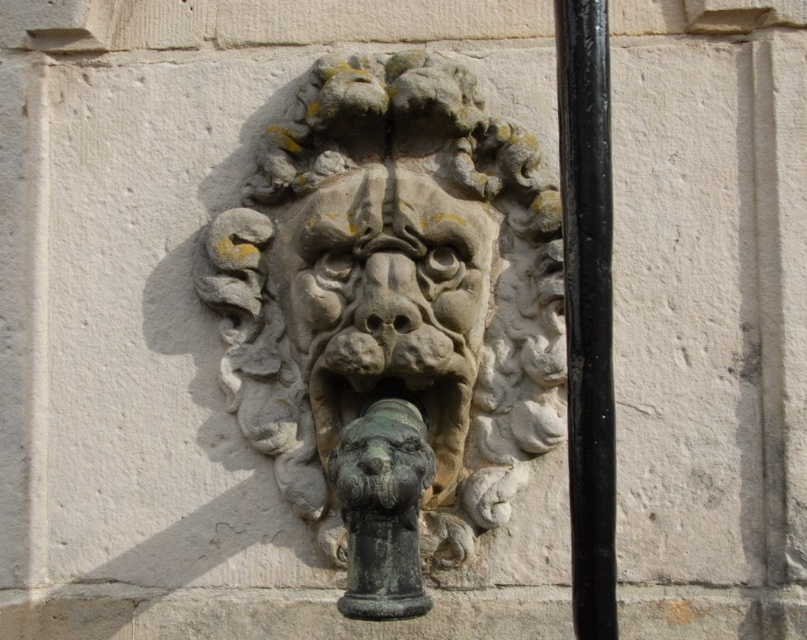
Question: Is stone textured face at center below black metal pole at right?

Choices:
 (A) no
 (B) yes

Answer: (A)

Question: Which point appears closest to the camera in this image?

Choices:
 (A) (554, 256)
 (B) (583, 33)

Answer: (B)

Question: Which of the following is the closest to the observer?

Choices:
 (A) (557, 380)
 (B) (339, 248)
 (C) (358, 460)
 (D) (567, 324)

Answer: (C)

Question: Is black metal pole at right to the right of bronze statue at center from the viewer's perspective?

Choices:
 (A) yes
 (B) no

Answer: (A)

Question: Which point is closer to the camera taking this photo?

Choices:
 (A) (394, 454)
 (B) (578, 349)
 (C) (421, 262)

Answer: (B)

Question: Is stone textured lion head at center smaller than stone textured face at center?

Choices:
 (A) no
 (B) yes

Answer: (A)